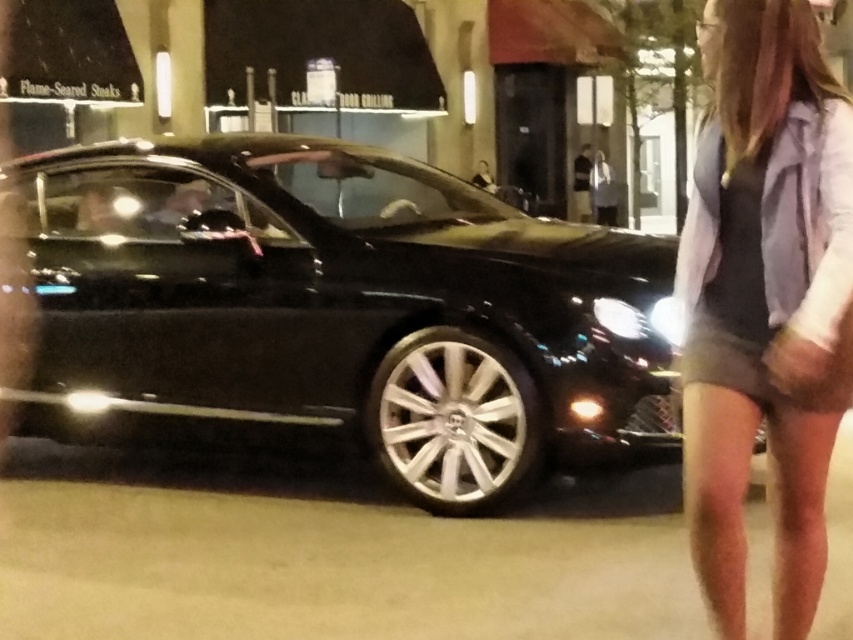
Question: Where is shiny black car at center located in relation to gray fabric shorts at lower right in the image?

Choices:
 (A) left
 (B) right

Answer: (A)

Question: Among these objects, which one is farthest from the camera?

Choices:
 (A) gray fabric shorts at lower right
 (B) shiny black car at center

Answer: (B)

Question: Does shiny black car at center come in front of gray fabric shorts at lower right?

Choices:
 (A) no
 (B) yes

Answer: (A)

Question: Which point appears closest to the camera in this image?

Choices:
 (A) (817, 589)
 (B) (277, 195)

Answer: (A)

Question: Is shiny black car at center positioned before gray fabric shorts at lower right?

Choices:
 (A) yes
 (B) no

Answer: (B)